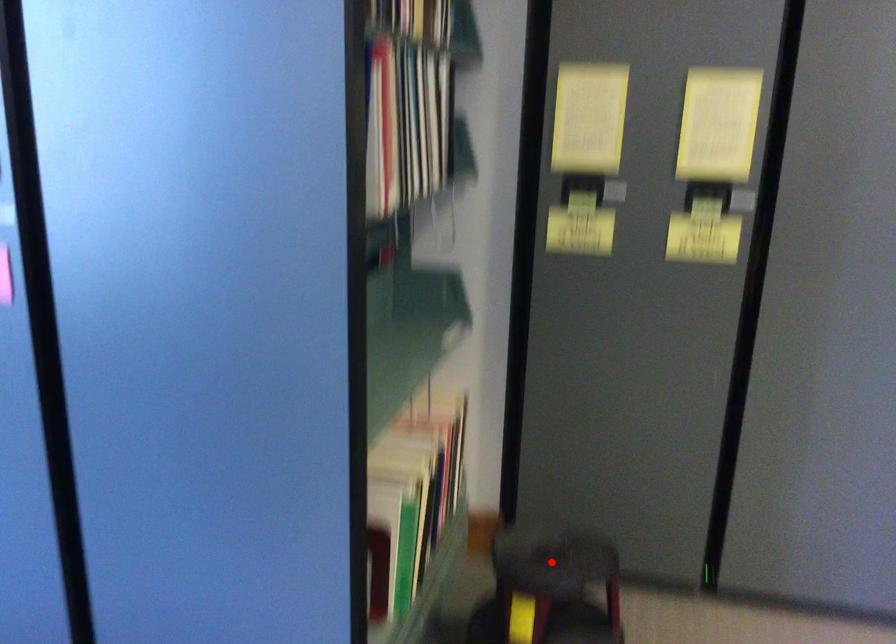
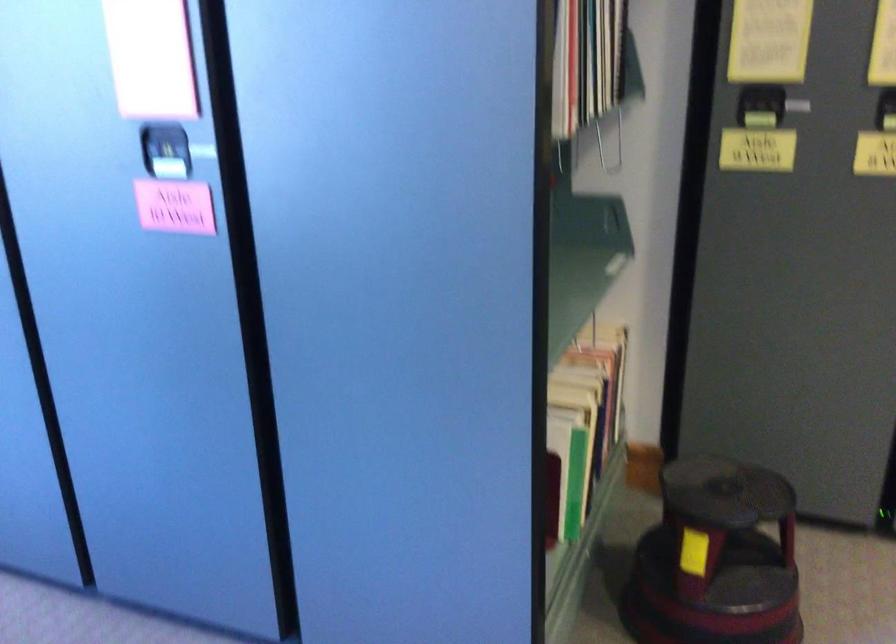
Question: I am providing you with two images of the same scene from different viewpoints. A red point is marked on the first image. Can you still see the location of the red point in image 2?

Choices:
 (A) Yes
 (B) No

Answer: (A)